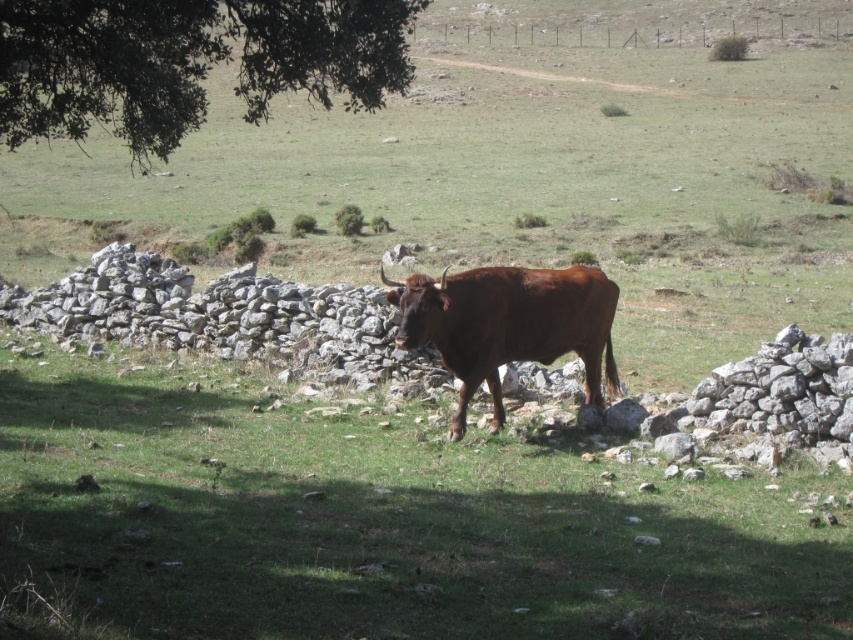
You are standing in the field and see the green leafy tree at upper left and the brown glossy bull at center. Which object is positioned more to the left side of the image?

The green leafy tree at upper left is positioned more to the left side of the image than the brown glossy bull at center.

You are a farmer who wants to ensure the brown glossy bull at center has enough space to move freely. Given that the brown grassy at center is larger than the bull, do you think the bull has enough space to move around in the area?

The brown grassy at center has a larger size compared to brown glossy bull at center, which means there is sufficient space for the bull to move around freely.